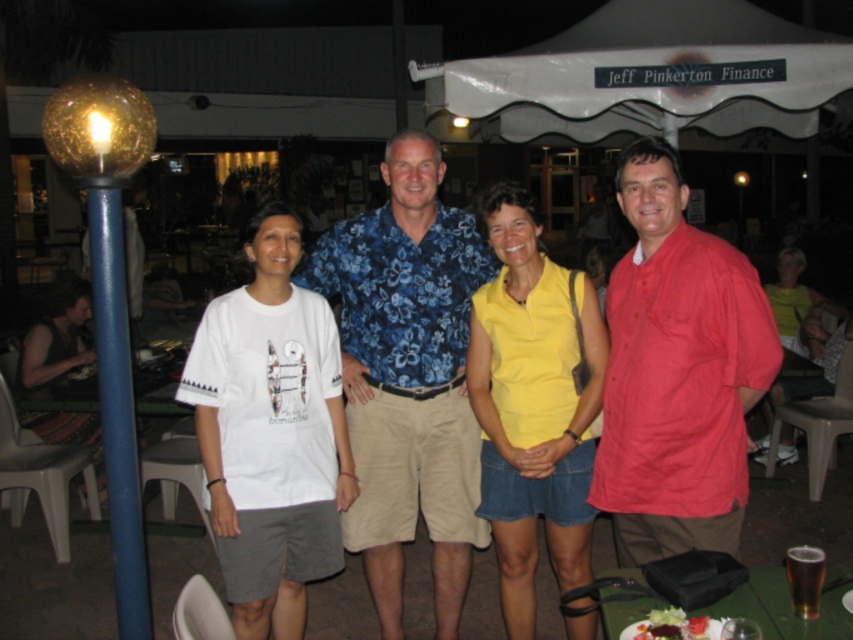
You are a photographer setting up for a group photo at the outdoor dining area. You need to ensure that the group is positioned under the white fabric canopy at upper center while also facing the green plastic table at lower right. Is the table within the canopy area?

The white fabric canopy at upper center is above the green plastic table at lower right, so the table is within the canopy area.